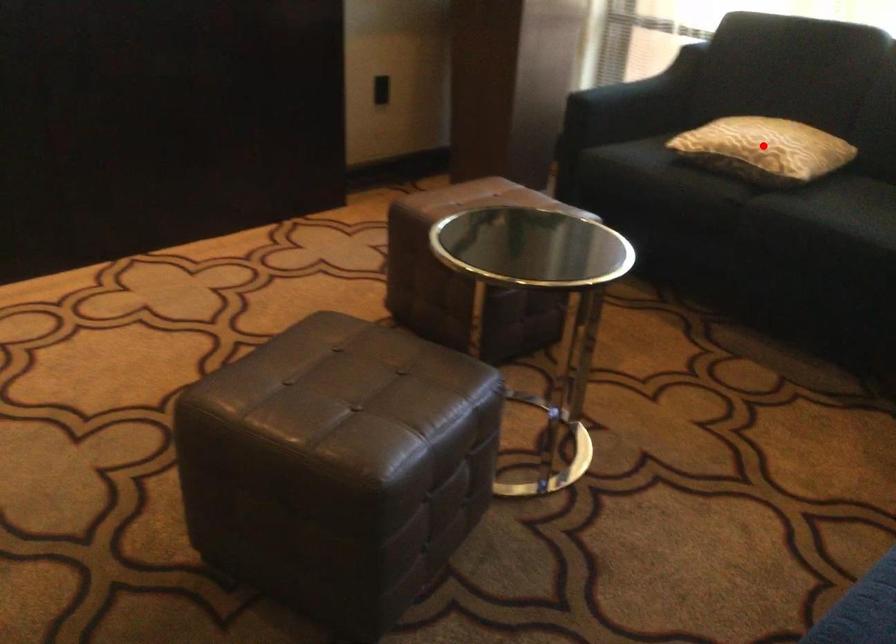
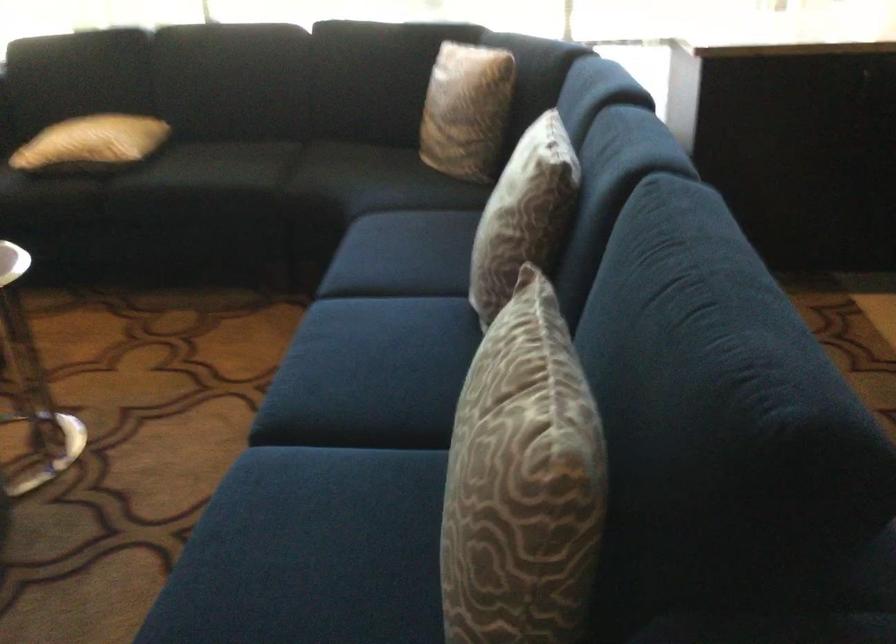
Question: I am providing you with two images of the same scene from different viewpoints. A red point is shown in image1. For the corresponding object point in image2, is it positioned nearer or farther from the camera?

Choices:
 (A) Nearer
 (B) Farther

Answer: (B)